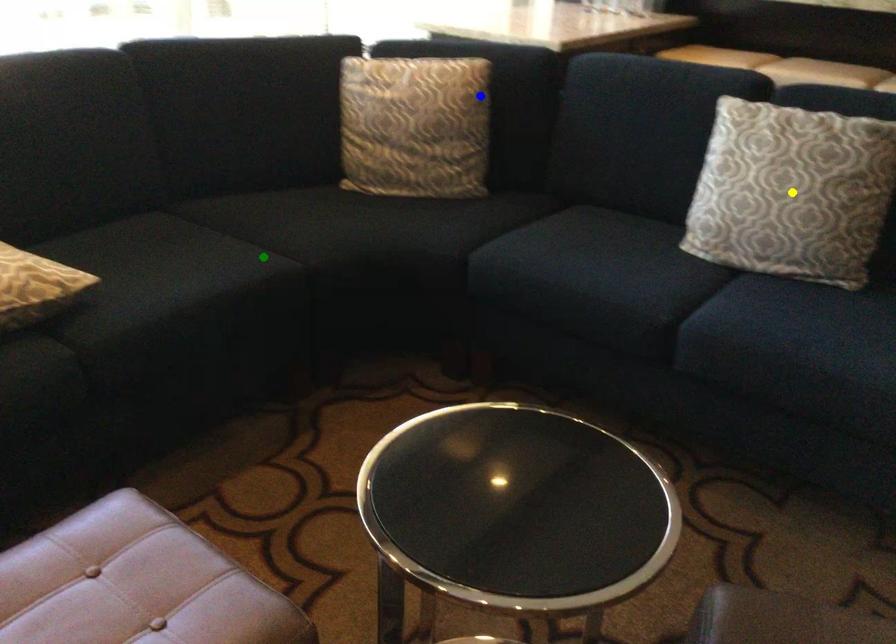
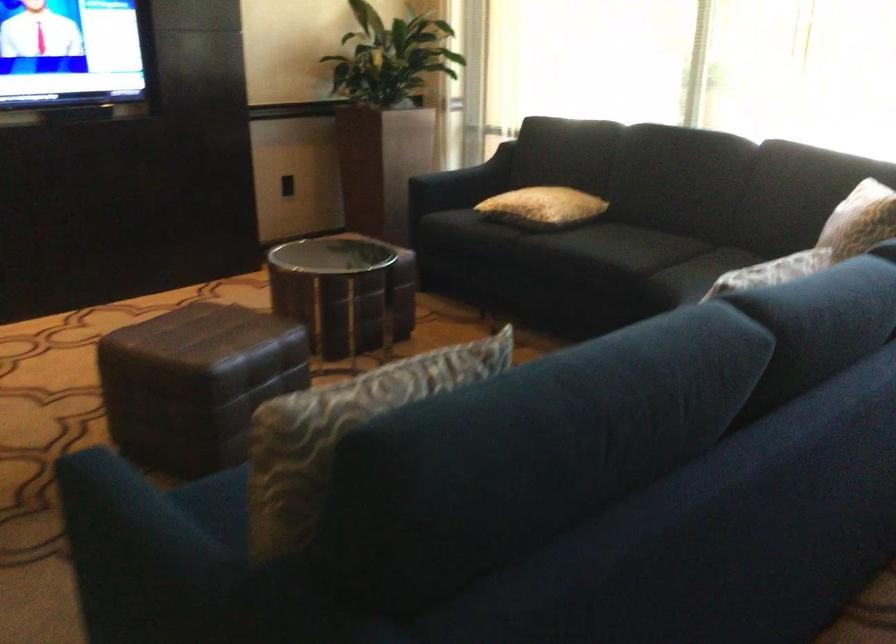
I am providing you with two images of the same scene from different viewpoints. Three points are marked in image1. Which point corresponds to a part or object that is occluded in image2?In image1, three points are marked. Which of them correspond to a part or object that is occluded in image2?Among the three points shown in image1, which one corresponds to a part or object that is no longer visible due to occlusion in image2?

Invisible in image2: yellow point.